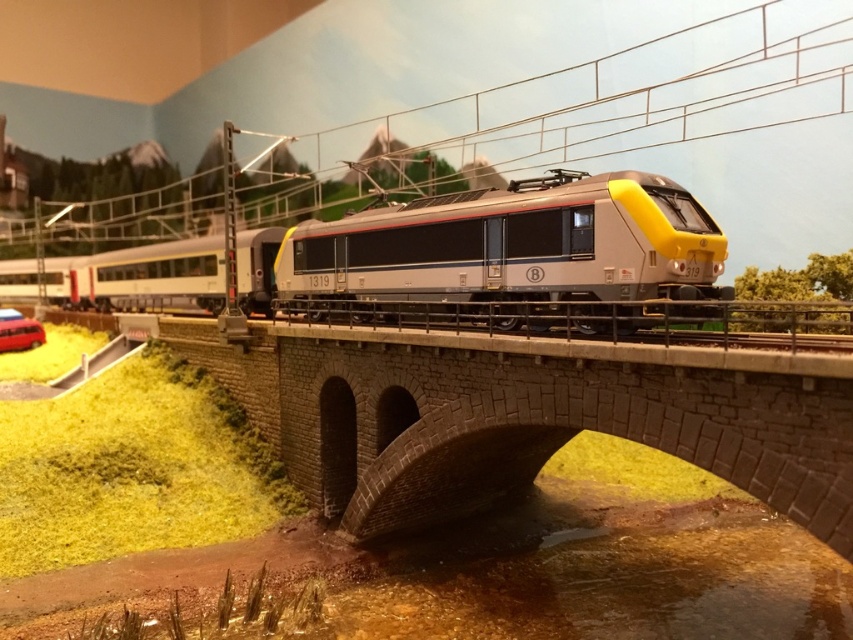
Can you confirm if metallic silver train at center is smaller than matte red car at lower left?

No, metallic silver train at center is not smaller than matte red car at lower left.

Locate an element on the screen. The width and height of the screenshot is (853, 640). metallic silver train at center is located at coordinates (498, 257).

Which of these two, stone bridge at center or matte red car at lower left, stands shorter?

matte red car at lower left

Who is higher up, stone bridge at center or matte red car at lower left?

Positioned higher is matte red car at lower left.

The width and height of the screenshot is (853, 640). Find the location of `stone bridge at center`. stone bridge at center is located at coordinates (525, 416).

At what (x,y) coordinates should I click in order to perform the action: click on stone bridge at center. Please return your answer as a coordinate pair (x, y). Looking at the image, I should click on [525, 416].

Which is below, stone bridge at center or metallic silver train at center?

Positioned lower is stone bridge at center.

Consider the image. Which is more to the right, stone bridge at center or metallic silver train at center?

stone bridge at center

Identify the location of stone bridge at center. The width and height of the screenshot is (853, 640). (525, 416).

Where is `stone bridge at center`? The width and height of the screenshot is (853, 640). stone bridge at center is located at coordinates (525, 416).